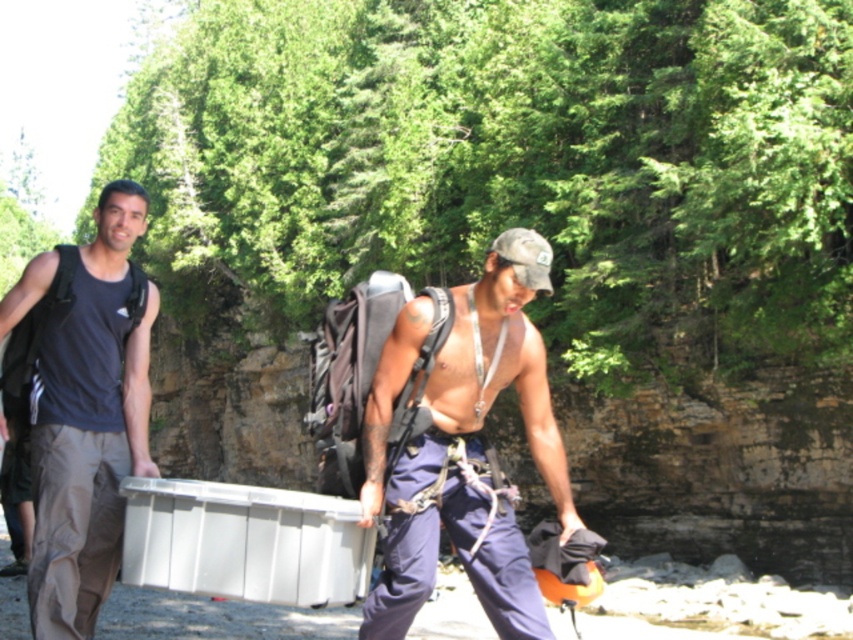
Question: Which of the following is the farthest from the observer?

Choices:
 (A) (x=54, y=586)
 (B) (x=440, y=456)

Answer: (A)

Question: Is shiny blue pants at center to the right of matte gray tank top at left from the viewer's perspective?

Choices:
 (A) no
 (B) yes

Answer: (B)

Question: Is shiny blue pants at center to the right of matte gray tank top at left from the viewer's perspective?

Choices:
 (A) no
 (B) yes

Answer: (B)

Question: Is shiny blue pants at center in front of matte gray tank top at left?

Choices:
 (A) yes
 (B) no

Answer: (A)